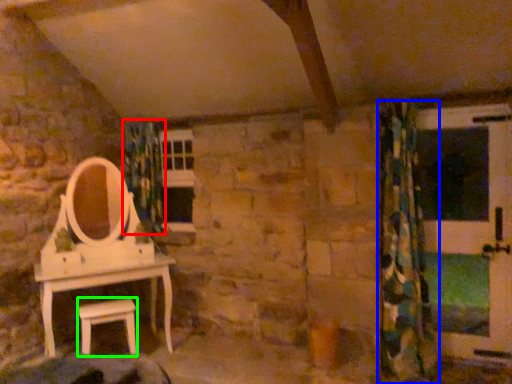
Question: Considering the real-world distances, which object is closest to shower curtain (highlighted by a red box)? curtain (highlighted by a blue box) or furniture (highlighted by a green box).

Choices:
 (A) curtain
 (B) furniture

Answer: (B)